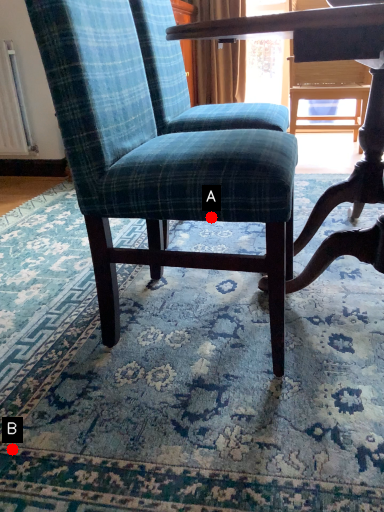
Question: Two points are circled on the image, labeled by A and B beside each circle. Which of the following is the closest to the observer?

Choices:
 (A) A is closer
 (B) B is closer

Answer: (B)